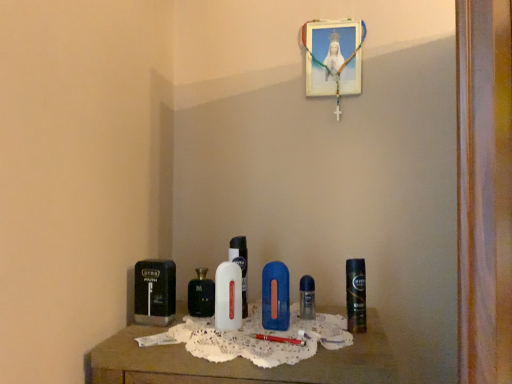
The width and height of the screenshot is (512, 384). Identify the location of free location to the left of white glossy bottle at center, the 4th perfume when ordered from back to front. (176, 330).